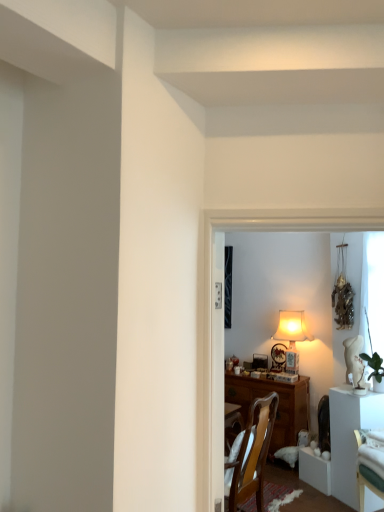
Question: From the image's perspective, would you say white glossy table at right is shown under green leafy plant at right?

Choices:
 (A) yes
 (B) no

Answer: (A)

Question: Considering the relative positions of white glossy table at right and green leafy plant at right in the image provided, is white glossy table at right to the right of green leafy plant at right from the viewer's perspective?

Choices:
 (A) no
 (B) yes

Answer: (A)

Question: From the image's perspective, is white glossy table at right over green leafy plant at right?

Choices:
 (A) no
 (B) yes

Answer: (A)

Question: Does white glossy table at right turn towards green leafy plant at right?

Choices:
 (A) no
 (B) yes

Answer: (A)

Question: Is green leafy plant at right surrounded by white glossy table at right?

Choices:
 (A) yes
 (B) no

Answer: (B)

Question: From a real-world perspective, is white glossy table at right on green leafy plant at right?

Choices:
 (A) yes
 (B) no

Answer: (B)

Question: Does green leafy plant at right appear on the right side of white glossy table at right?

Choices:
 (A) no
 (B) yes

Answer: (B)

Question: Is green leafy plant at right positioned before white glossy table at right?

Choices:
 (A) no
 (B) yes

Answer: (A)

Question: Considering the relative sizes of green leafy plant at right and white glossy table at right in the image provided, is green leafy plant at right taller than white glossy table at right?

Choices:
 (A) yes
 (B) no

Answer: (B)

Question: Is the depth of green leafy plant at right greater than that of white glossy table at right?

Choices:
 (A) yes
 (B) no

Answer: (A)

Question: Does green leafy plant at right contain white glossy table at right?

Choices:
 (A) yes
 (B) no

Answer: (B)

Question: From a real-world perspective, does green leafy plant at right stand above white glossy table at right?

Choices:
 (A) no
 (B) yes

Answer: (B)

Question: From a real-world perspective, is white glossy table at right physically located above or below green leafy plant at right?

Choices:
 (A) above
 (B) below

Answer: (B)